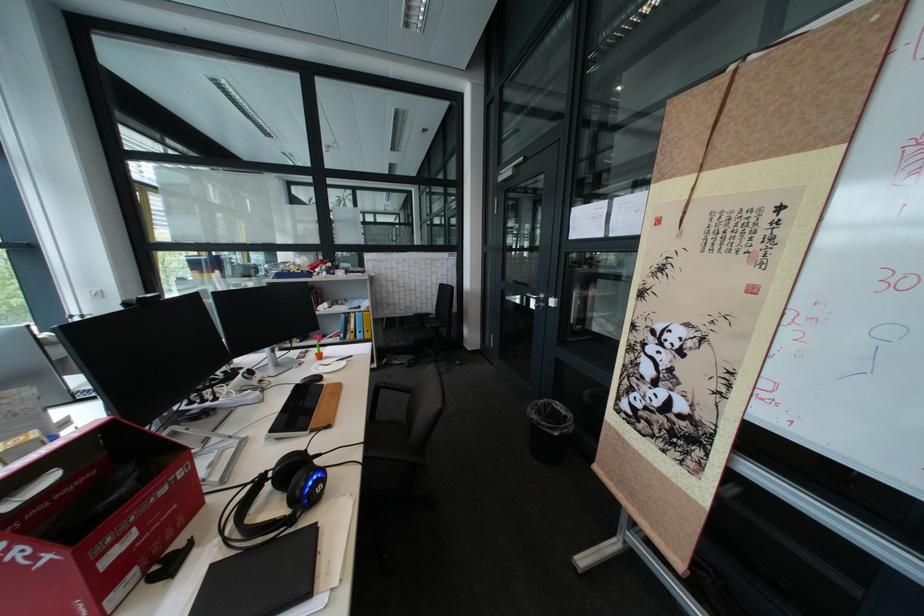
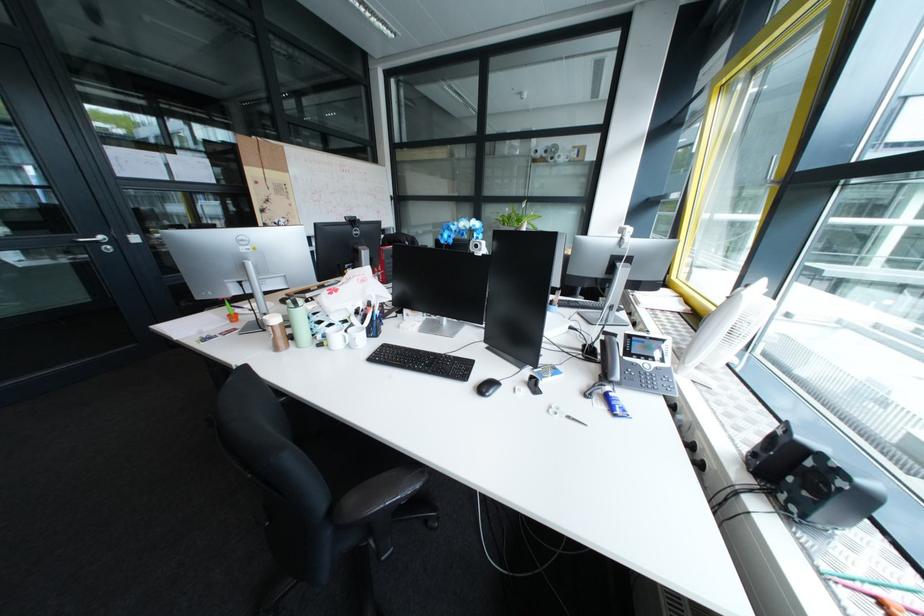
Question: I am providing you with two images of the same scene from different viewpoints. Please identify which objects are invisible in image2.

Choices:
 (A) green travel mug
 (B) black chair sitting surface
 (C) fireplace tool handle
 (D) white desk fan

Answer: (B)